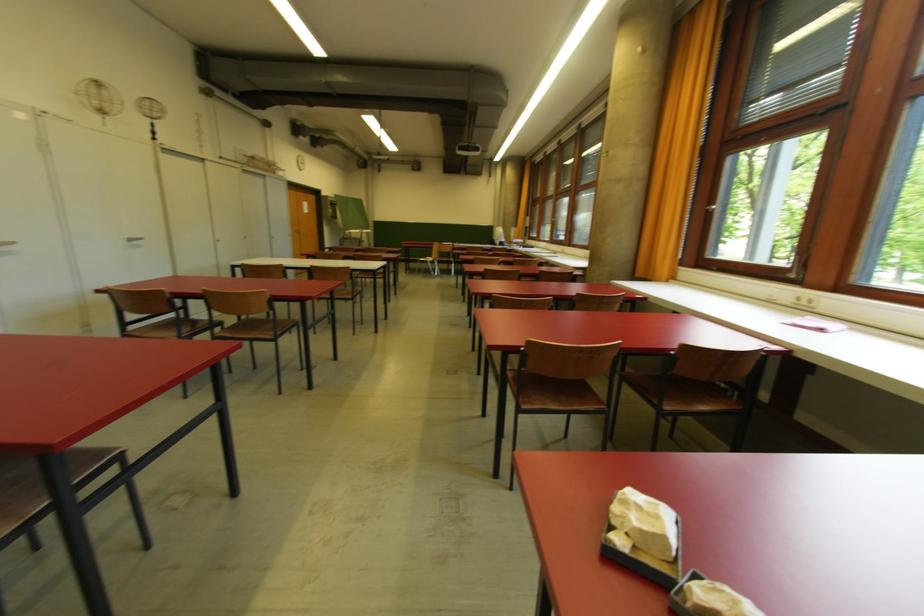
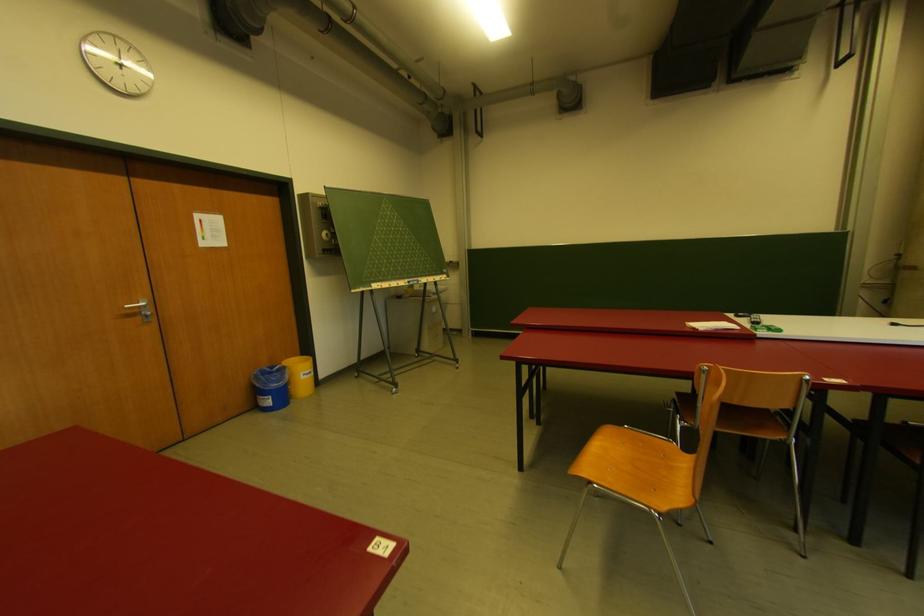
Locate, in the second image, the point that corresponds to point (334, 217) in the first image.

(326, 252)